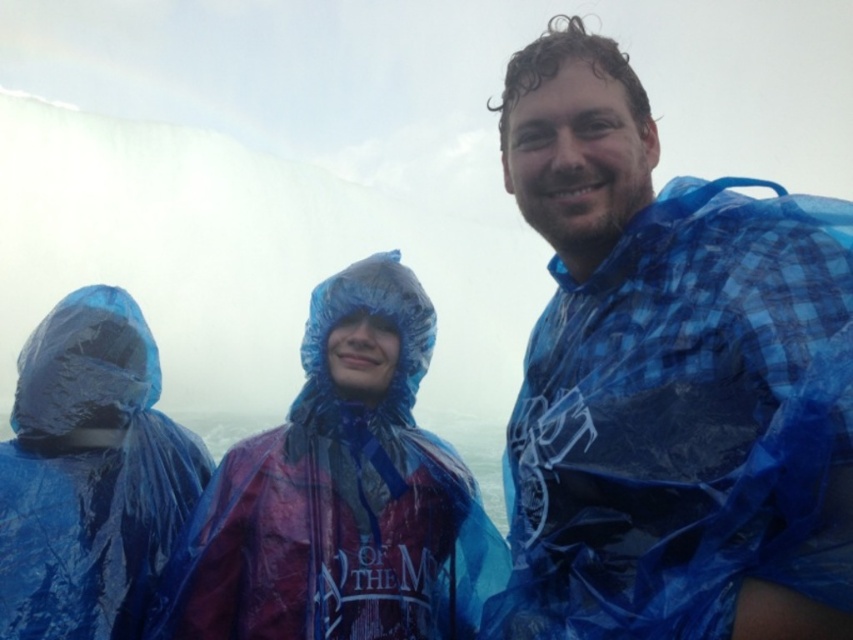
Does blue plastic raincoat at center have a lesser width compared to transparent plastic raincoat at center?

Correct, blue plastic raincoat at center's width is less than transparent plastic raincoat at center's.

Is point (809, 512) in front of point (326, 337)?

That is True.

Where is `blue plastic raincoat at center`? blue plastic raincoat at center is located at coordinates (669, 381).

You are a GUI agent. You are given a task and a screenshot of the screen. Output one action in this format:
    pyautogui.click(x=<x>, y=<y>)
    Task: Click on the blue plastic raincoat at center
    
    Given the screenshot: What is the action you would take?
    pyautogui.click(x=669, y=381)

Based on the photo, between blue plastic raincoat at center and blue plastic raincoat at left, which one is positioned lower?

blue plastic raincoat at left is lower down.

Identify the location of blue plastic raincoat at center. (669, 381).

Is point (418, 625) farther from viewer compared to point (126, 628)?

Yes, it is behind point (126, 628).

Is transparent plastic raincoat at center taller than blue plastic raincoat at left?

Yes.

What do you see at coordinates (340, 496) in the screenshot?
I see `transparent plastic raincoat at center` at bounding box center [340, 496].

The width and height of the screenshot is (853, 640). I want to click on transparent plastic raincoat at center, so click(x=340, y=496).